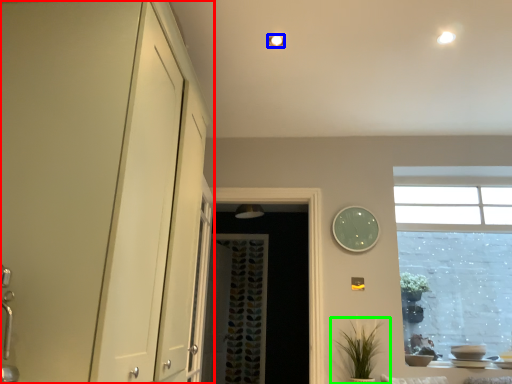
Question: Based on their relative distances, which object is farther from dresser (highlighted by a red box)? Choose from lighting (highlighted by a blue box) and houseplant (highlighted by a green box).

Choices:
 (A) lighting
 (B) houseplant

Answer: (B)